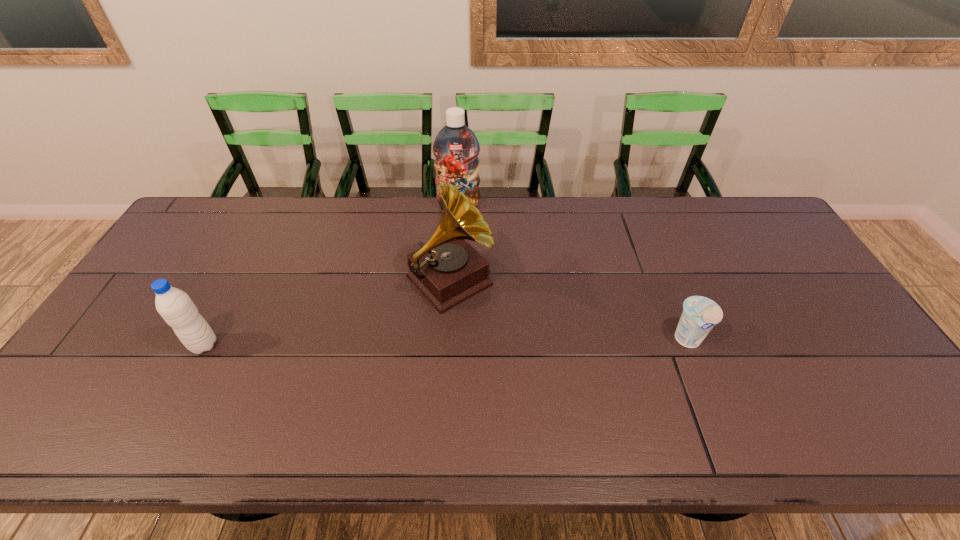
Find the location of a particular element. This screenshot has width=960, height=540. vacant space in between the farthest object and the yogurt is located at coordinates (573, 273).

Where is `free point between the leftmost object and the phonograph record`? The height and width of the screenshot is (540, 960). free point between the leftmost object and the phonograph record is located at coordinates (326, 313).

What are the coordinates of `empty location between the water bottle and the shampoo` in the screenshot? It's located at (331, 275).

You are a GUI agent. You are given a task and a screenshot of the screen. Output one action in this format:
    pyautogui.click(x=<x>, y=<y>)
    Task: Click on the vacant area that lies between the water bottle and the second farthest object
    The width and height of the screenshot is (960, 540).
    Given the screenshot: What is the action you would take?
    pyautogui.click(x=326, y=313)

Locate an element on the screen. Image resolution: width=960 pixels, height=540 pixels. free spot between the third nearest object and the yogurt is located at coordinates (569, 310).

The height and width of the screenshot is (540, 960). Find the location of `vacant region between the water bottle and the phonograph record`. vacant region between the water bottle and the phonograph record is located at coordinates (326, 313).

At what (x,y) coordinates should I click in order to perform the action: click on vacant space that's between the farthest object and the rightmost object. Please return your answer as a coordinate pair (x, y). Looking at the image, I should click on (x=573, y=273).

The width and height of the screenshot is (960, 540). What are the coordinates of `free spot between the leftmost object and the phonograph record` in the screenshot? It's located at (326, 313).

I want to click on vacant region between the third nearest object and the water bottle, so tap(326, 313).

Locate which object is the closest to the farthest object. Please provide its 2D coordinates. Your answer should be formatted as a tuple, i.e. [(x, y)], where the tuple contains the x and y coordinates of a point satisfying the conditions above.

[(447, 270)]